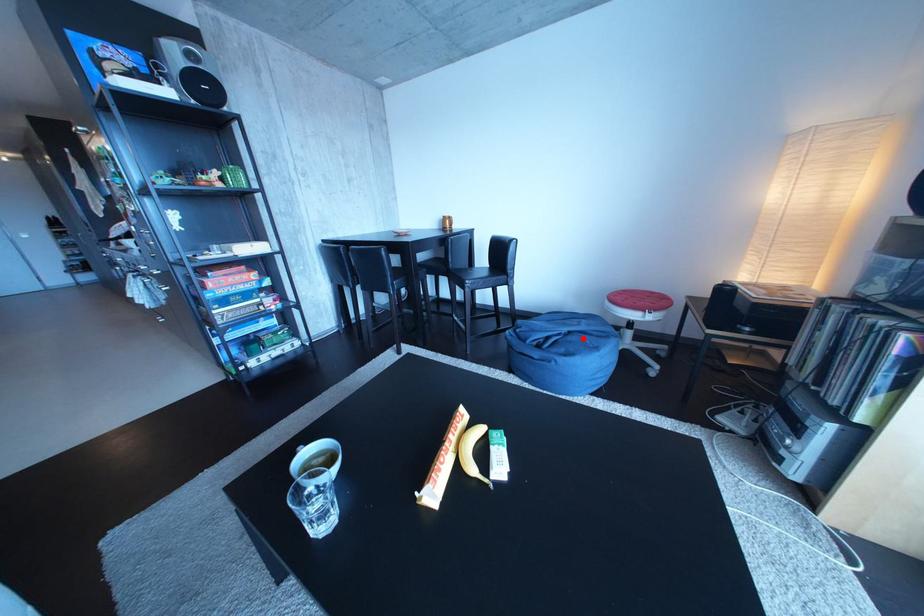
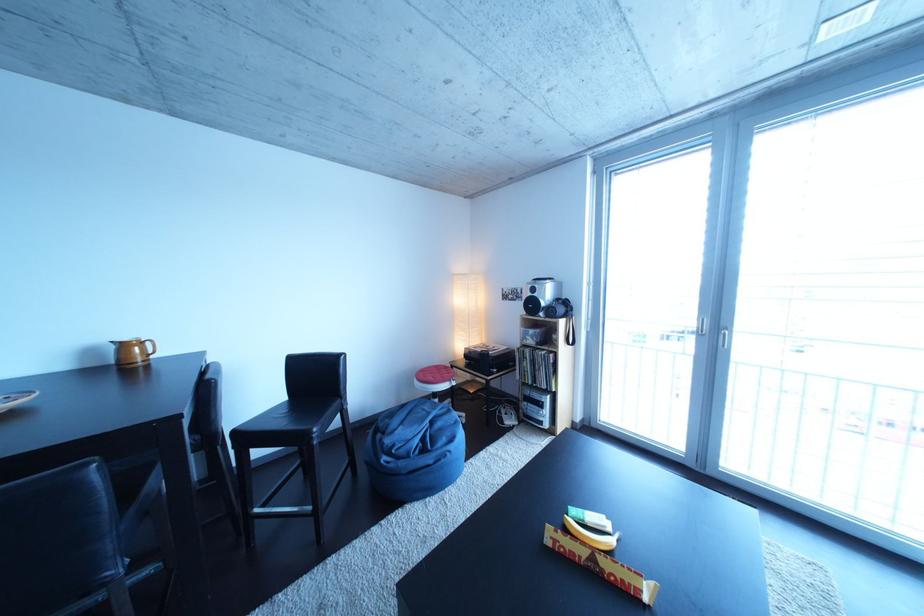
Question: I am providing you with two images of the same scene from different viewpoints. A red point is marked on the first image. At the location where the point appears in image 1, is it still visible in image 2?

Choices:
 (A) Yes
 (B) No

Answer: (A)